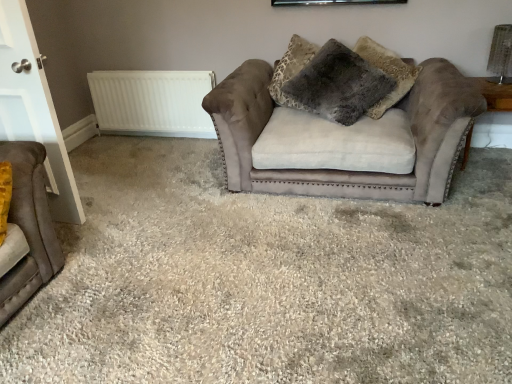
Question: Does wooden side table at right appear on the right side of white glossy door at left?

Choices:
 (A) yes
 (B) no

Answer: (A)

Question: Is wooden side table at right further to camera compared to white glossy door at left?

Choices:
 (A) yes
 (B) no

Answer: (A)

Question: Considering the relative sizes of wooden side table at right and white glossy door at left in the image provided, is wooden side table at right wider than white glossy door at left?

Choices:
 (A) yes
 (B) no

Answer: (A)

Question: Does wooden side table at right have a lesser height compared to white glossy door at left?

Choices:
 (A) no
 (B) yes

Answer: (B)

Question: Can you confirm if wooden side table at right is taller than white glossy door at left?

Choices:
 (A) yes
 (B) no

Answer: (B)

Question: From the image's perspective, relative to white glossy door at left, is suede couch at center above or below?

Choices:
 (A) below
 (B) above

Answer: (A)

Question: Is point (155, 259) positioned closer to the camera than point (23, 72)?

Choices:
 (A) closer
 (B) farther

Answer: (B)

Question: Considering the positions of suede couch at center and white glossy door at left in the image, is suede couch at center taller or shorter than white glossy door at left?

Choices:
 (A) tall
 (B) short

Answer: (B)

Question: From a real-world perspective, is suede couch at center positioned above or below white glossy door at left?

Choices:
 (A) above
 (B) below

Answer: (B)

Question: Is wooden side table at right inside or outside of suede couch at center?

Choices:
 (A) inside
 (B) outside

Answer: (B)

Question: From a real-world perspective, relative to suede couch at center, is wooden side table at right vertically above or below?

Choices:
 (A) below
 (B) above

Answer: (B)

Question: Is point (466, 135) positioned closer to the camera than point (317, 377)?

Choices:
 (A) farther
 (B) closer

Answer: (A)

Question: Visually, is wooden side table at right positioned to the left or to the right of suede couch at center?

Choices:
 (A) left
 (B) right

Answer: (B)

Question: In terms of size, does velvet brown studio couch at left, positioned as the 2th studio couch in right-to-left order, appear bigger or smaller than fuzzy gray pillow at center?

Choices:
 (A) small
 (B) big

Answer: (A)

Question: From their relative heights in the image, would you say velvet brown studio couch at left, the 1th studio couch when ordered from left to right, is taller or shorter than fuzzy gray pillow at center?

Choices:
 (A) short
 (B) tall

Answer: (A)